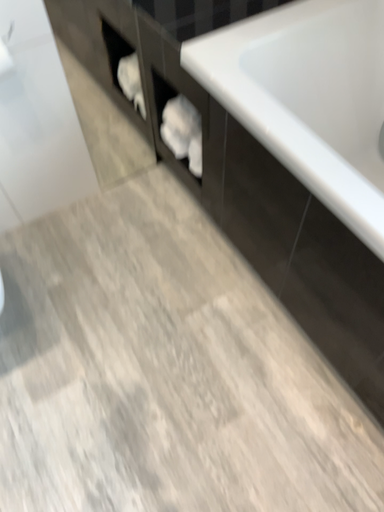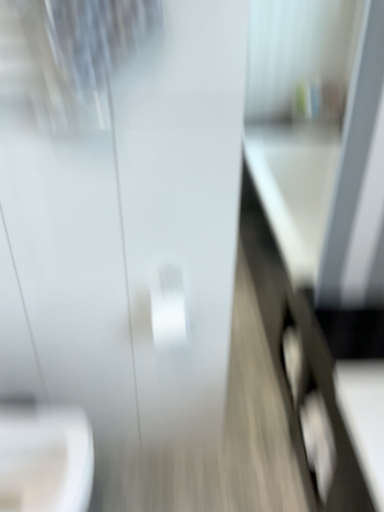
Question: Which way did the camera rotate in the video?

Choices:
 (A) rotated upward
 (B) rotated downward

Answer: (A)